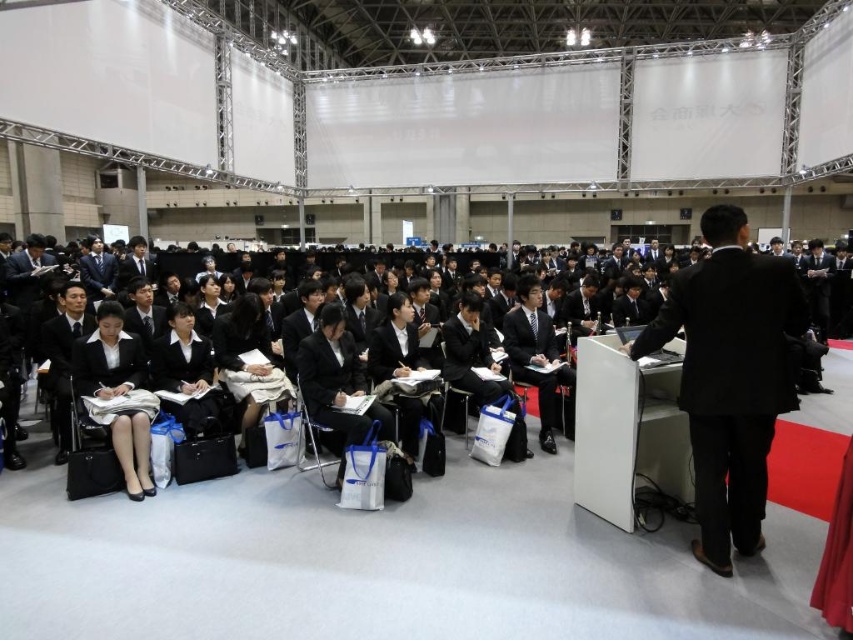
Question: Among these points, which one is nearest to the camera?

Choices:
 (A) (730, 525)
 (B) (509, 321)
 (C) (49, 372)

Answer: (A)

Question: Which point is farther to the camera?

Choices:
 (A) (77, 346)
 (B) (53, 374)

Answer: (B)

Question: Does black smooth suit at right appear on the left side of matte black suit at center?

Choices:
 (A) no
 (B) yes

Answer: (A)

Question: Can you confirm if black fabric skirt at lower left is positioned to the right of black matte suit at center?

Choices:
 (A) yes
 (B) no

Answer: (B)

Question: Which of the following is the closest to the observer?

Choices:
 (A) (364, 420)
 (B) (79, 337)

Answer: (A)

Question: Does black smooth suit at right appear under black fabric skirt at lower left?

Choices:
 (A) yes
 (B) no

Answer: (B)